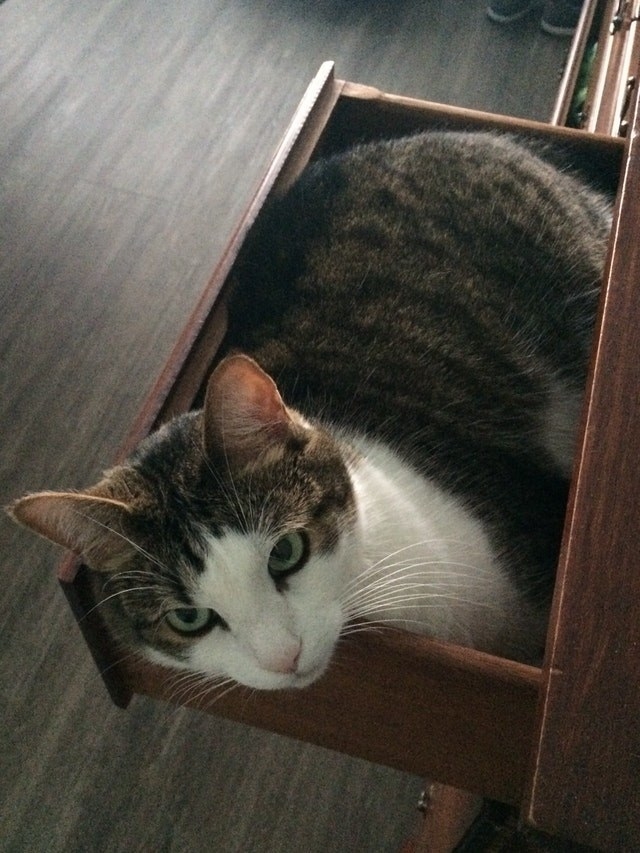
Locate an element on the screen. inside of the drawer is located at coordinates (598, 172).